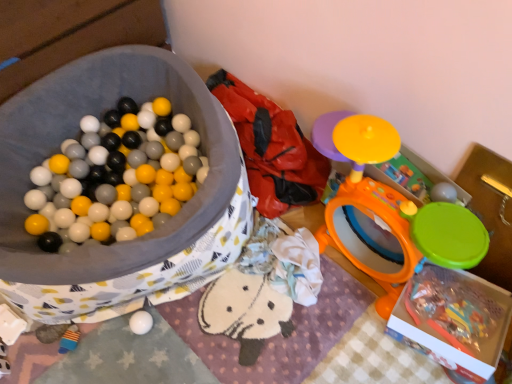
Image resolution: width=512 pixels, height=384 pixels. I want to click on free space to the left of translucent plastic storage box at lower right, the second storage box when ordered from left to right, so click(x=358, y=329).